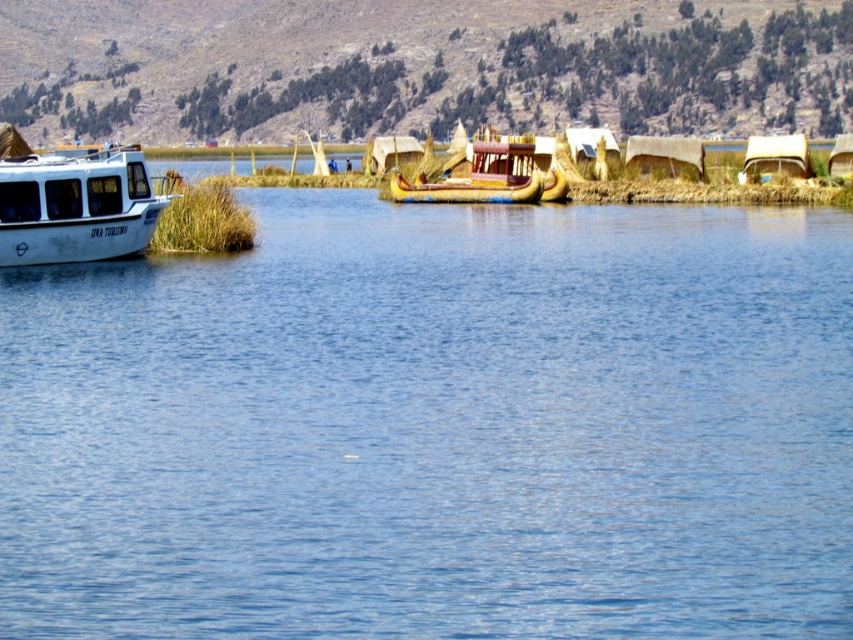
You are navigating a small drone over the serene water scene. The drone is currently above the white motorboat labeled UNA TURISMO. To ensure safe flight, you need to avoid the reed boats called Uros. Which direction should you steer the drone to stay over the blue water at center?

The blue water at center is located at point (x=436, y=428), so steering the drone towards that coordinate will keep it over the blue water at center while avoiding the Uros reed boats.

You are a tourist standing on the golden woven reed boat at center. You want to jump into the blue water at center for a swim. Is the water level higher than the boat? Explain why.

The blue water at center is taller than the golden woven reed boat at center. This means the water level is higher than the boat, so jumping in would be possible as the water is above the boat level.

You are standing on the shore of the lake and want to take a photo of the white matte boat at left. If your camera has a maximum zoom range of 50 meters, will you be able to capture the boat clearly?

The white matte boat at left is 41.32 meters away from the viewer. Since the camera can zoom up to 50 meters, you can capture the boat clearly within the zoom range.